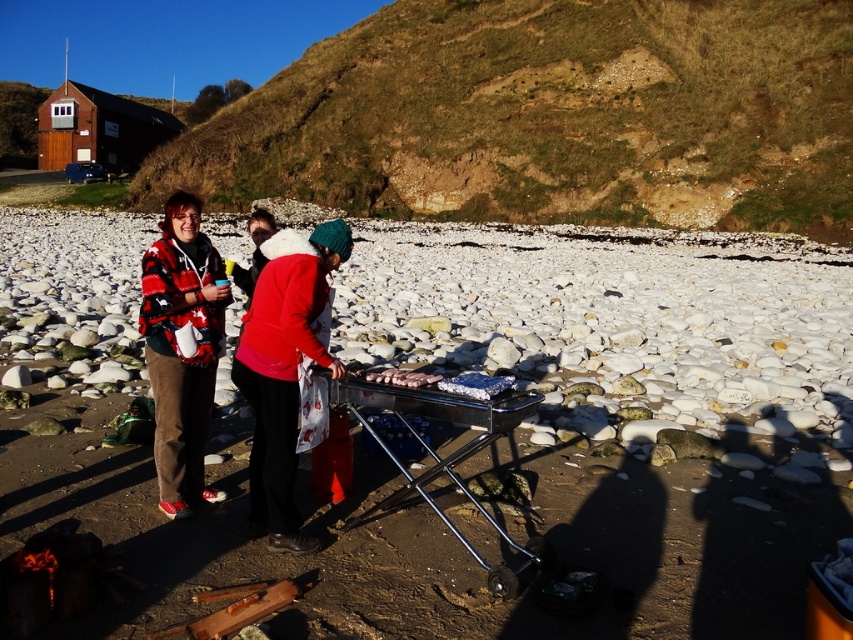
You are standing at point (374, 145) and want to reach the barbecue grill. The distance between you and the barbecue grill is 192.94 feet. Can you walk directly to it without any obstacles?

The distance between you and the barbecue grill is 192.94 feet, so yes, you can walk directly to it without any obstacles since there are no mentioned obstacles in the scene description.

You are planning to set up a picnic blanket near the metallic silver barbecue grill at center. Considering the brown grassy hillside at upper center, where should you place the blanket to avoid the slope?

The brown grassy hillside at upper center is located above the metallic silver barbecue grill at center, so placing the picnic blanket below the grill away from the slope would be safer.

You are standing at the barbecue grill in the foreground. Looking towards the upper center of the image, where would you see the brown grassy hillside at upper center?

The brown grassy hillside at upper center is located at point 0.183 on the x axis and 0.644 on the y axis.